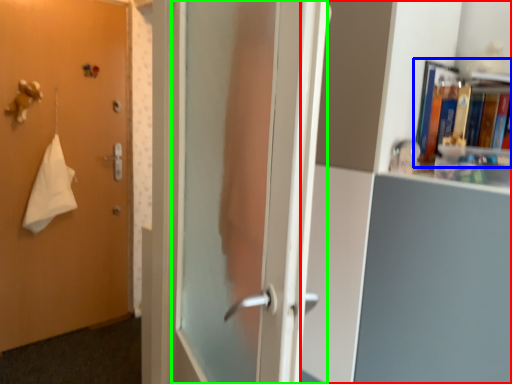
Question: Which is nearer to the bookcase (highlighted by a red box)? book (highlighted by a blue box) or screen door (highlighted by a green box).

Choices:
 (A) book
 (B) screen door

Answer: (A)